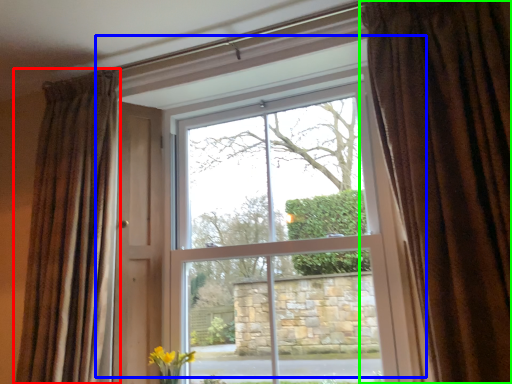
Question: Based on their relative distances, which object is farther from curtain (highlighted by a red box)? Choose from window (highlighted by a blue box) and curtain (highlighted by a green box).

Choices:
 (A) window
 (B) curtain

Answer: (B)